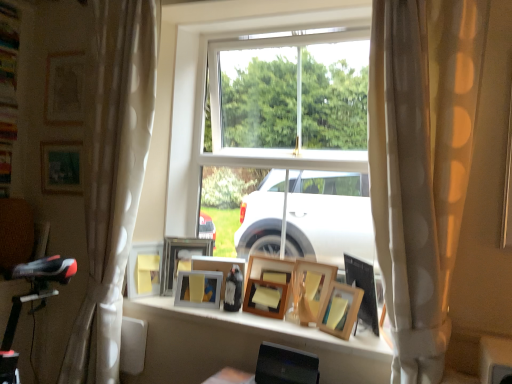
Question: Is wooden picture frame at center, positioned as the 4th picture frame in right-to-left order, positioned before wooden picture frame at center, acting as the ninth picture frame starting from the left?

Choices:
 (A) no
 (B) yes

Answer: (A)

Question: Would you say wooden picture frame at center, positioned as the 4th picture frame in right-to-left order, contains wooden picture frame at center, positioned as the 2th picture frame in right-to-left order?

Choices:
 (A) yes
 (B) no

Answer: (B)

Question: Considering the relative positions of wooden picture frame at center, positioned as the 4th picture frame in right-to-left order, and wooden picture frame at center, positioned as the 2th picture frame in right-to-left order, in the image provided, is wooden picture frame at center, positioned as the 4th picture frame in right-to-left order, to the left of wooden picture frame at center, positioned as the 2th picture frame in right-to-left order, from the viewer's perspective?

Choices:
 (A) yes
 (B) no

Answer: (A)

Question: Can you confirm if wooden picture frame at center, acting as the 7th picture frame starting from the left, is bigger than wooden picture frame at center, positioned as the 2th picture frame in right-to-left order?

Choices:
 (A) no
 (B) yes

Answer: (B)

Question: Is wooden picture frame at center, acting as the 7th picture frame starting from the left, in contact with wooden picture frame at center, positioned as the 2th picture frame in right-to-left order?

Choices:
 (A) no
 (B) yes

Answer: (A)

Question: Is point (252, 281) closer or farther from the camera than point (304, 276)?

Choices:
 (A) farther
 (B) closer

Answer: (A)

Question: Which is correct: wooden picture frame at center, positioned as the 4th picture frame in right-to-left order, is inside wooden picture frame at center, which is the third picture frame from right to left, or outside of it?

Choices:
 (A) inside
 (B) outside

Answer: (B)

Question: Considering their positions, is wooden picture frame at center, acting as the 7th picture frame starting from the left, located in front of or behind wooden picture frame at center, which is the third picture frame from right to left?

Choices:
 (A) front
 (B) behind

Answer: (B)

Question: Is wooden picture frame at center, positioned as the 4th picture frame in right-to-left order, bigger or smaller than wooden picture frame at center, which ranks as the 8th picture frame in left-to-right order?

Choices:
 (A) small
 (B) big

Answer: (A)

Question: Is wooden picture frame at center, which is the tenth picture frame from left to right, to the left or to the right of wooden picture frame at center, the 6th picture frame positioned from the right, in the image?

Choices:
 (A) left
 (B) right

Answer: (B)

Question: Considering the positions of wooden picture frame at center, which is the tenth picture frame from left to right, and wooden picture frame at center, the fifth picture frame viewed from the left, in the image, is wooden picture frame at center, which is the tenth picture frame from left to right, wider or thinner than wooden picture frame at center, the fifth picture frame viewed from the left,?

Choices:
 (A) wide
 (B) thin

Answer: (A)

Question: Is wooden picture frame at center, which is counted as the first picture frame, starting from the right, inside or outside of wooden picture frame at center, the fifth picture frame viewed from the left?

Choices:
 (A) outside
 (B) inside

Answer: (A)

Question: From a real-world perspective, is wooden picture frame at center, which is counted as the first picture frame, starting from the right, positioned above or below wooden picture frame at center, the 6th picture frame positioned from the right?

Choices:
 (A) above
 (B) below

Answer: (A)

Question: From their relative heights in the image, would you say wooden picture frame at center, the 6th picture frame positioned from the right, is taller or shorter than wooden picture frame at center, which is the tenth picture frame from left to right?

Choices:
 (A) short
 (B) tall

Answer: (A)

Question: Does point (212, 294) appear closer or farther from the camera than point (366, 304)?

Choices:
 (A) closer
 (B) farther

Answer: (B)